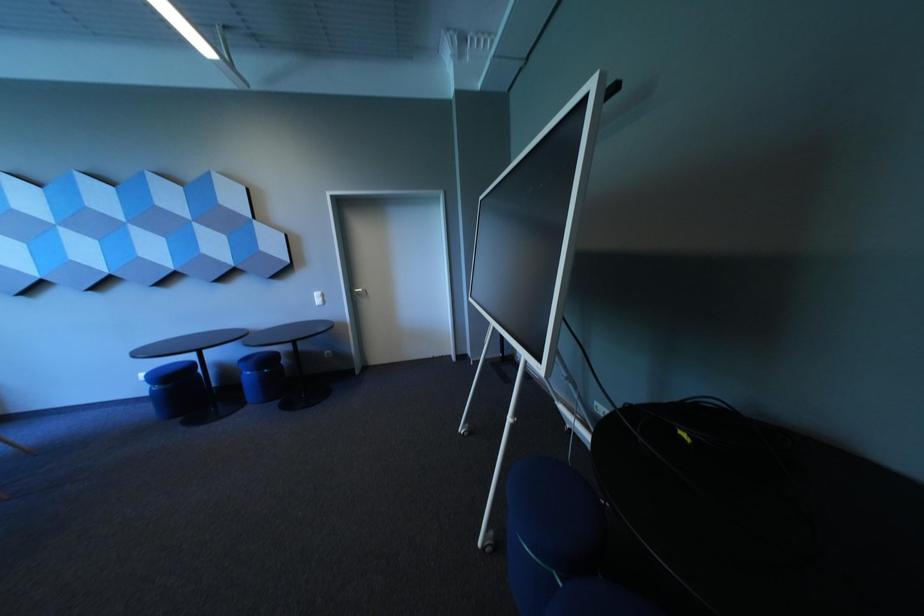
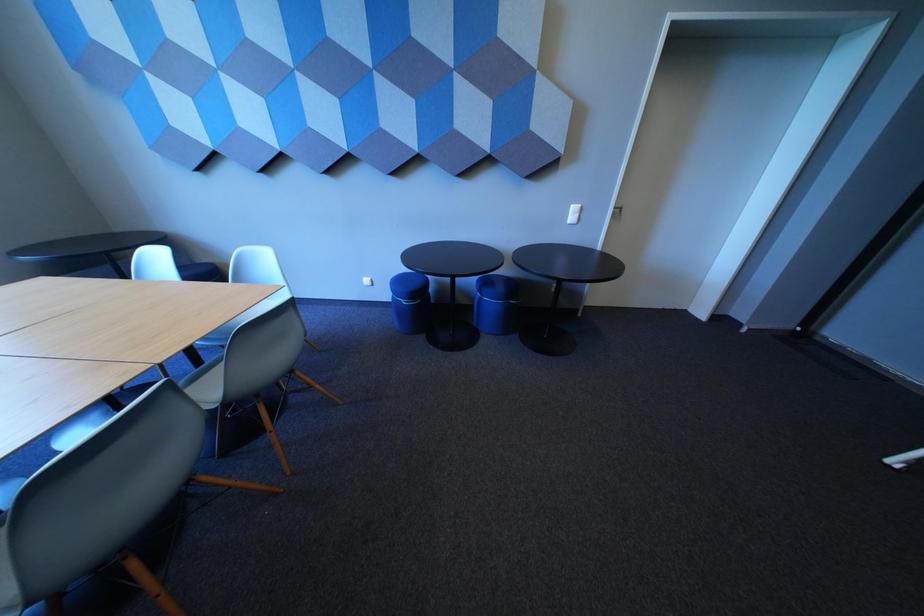
Question: Which direction would the cameraman need to move to produce the second image? Reply with the corresponding letter.

Choices:
 (A) Left
 (B) Right
 (C) Forward
 (D) Backward

Answer: (A)